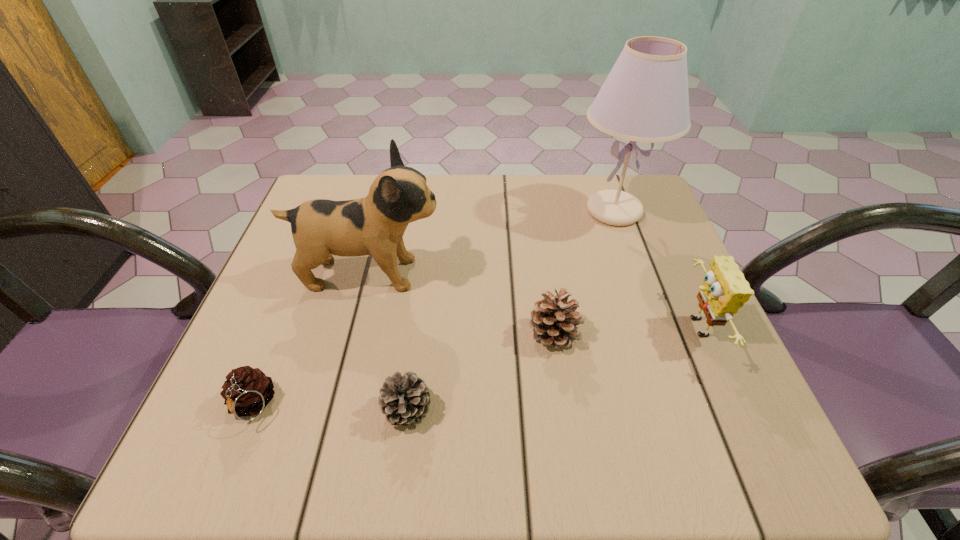
Locate an element on the screen. This screenshot has width=960, height=540. the farthest object is located at coordinates (645, 98).

Image resolution: width=960 pixels, height=540 pixels. I want to click on the tallest object, so click(x=645, y=98).

This screenshot has width=960, height=540. Identify the location of the fifth shortest object. coord(321,228).

Image resolution: width=960 pixels, height=540 pixels. Find the location of `sponge`. sponge is located at coordinates [724, 290].

Locate an element on the screen. The height and width of the screenshot is (540, 960). the fourth tallest object is located at coordinates (554, 319).

You are a GUI agent. You are given a task and a screenshot of the screen. Output one action in this format:
    pyautogui.click(x=<x>, y=<y>)
    Task: Click on the tallest pinecone
    The height and width of the screenshot is (540, 960).
    Given the screenshot: What is the action you would take?
    click(554, 319)

I want to click on the second pinecone from right to left, so click(x=404, y=399).

Image resolution: width=960 pixels, height=540 pixels. I want to click on the leftmost pinecone, so click(x=247, y=391).

You are a GUI agent. You are given a task and a screenshot of the screen. Output one action in this format:
    pyautogui.click(x=<x>, y=<y>)
    Task: Click on the free point located 0.350m on the left of the farthest object
    The width and height of the screenshot is (960, 540).
    Given the screenshot: What is the action you would take?
    pyautogui.click(x=436, y=211)

Locate an element on the screen. free point located at the face of the fifth shortest object is located at coordinates (600, 274).